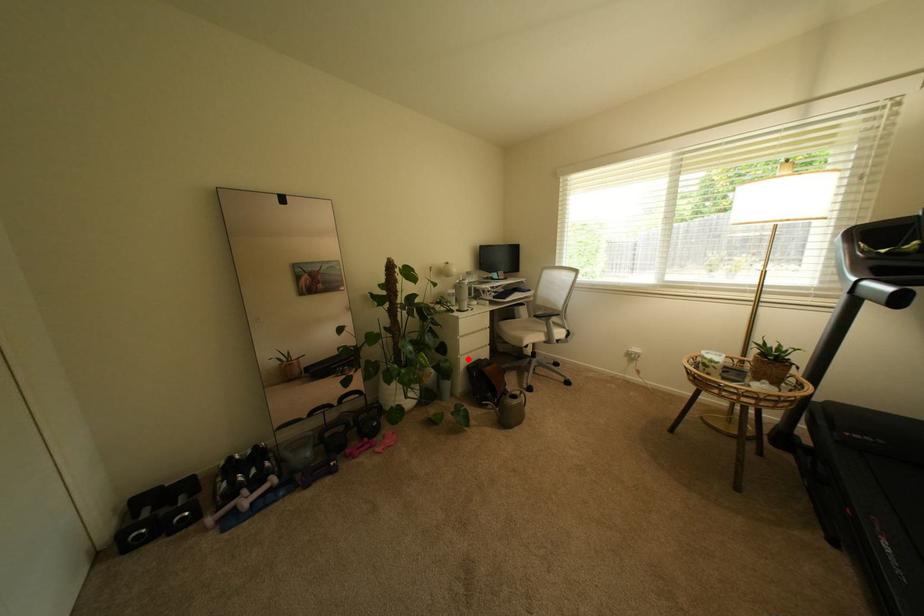
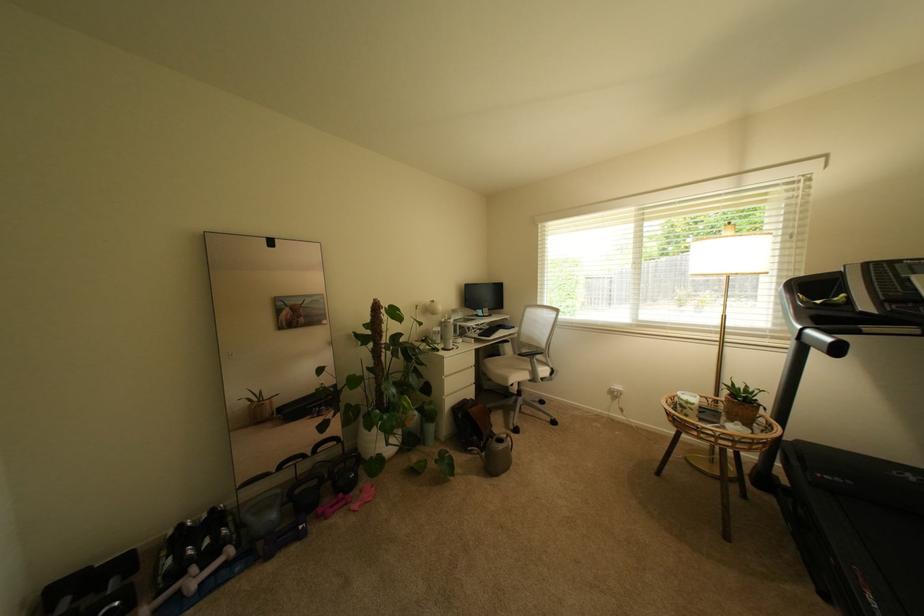
Locate, in the second image, the point that corresponds to the highlighted location in the first image.

(453, 400)